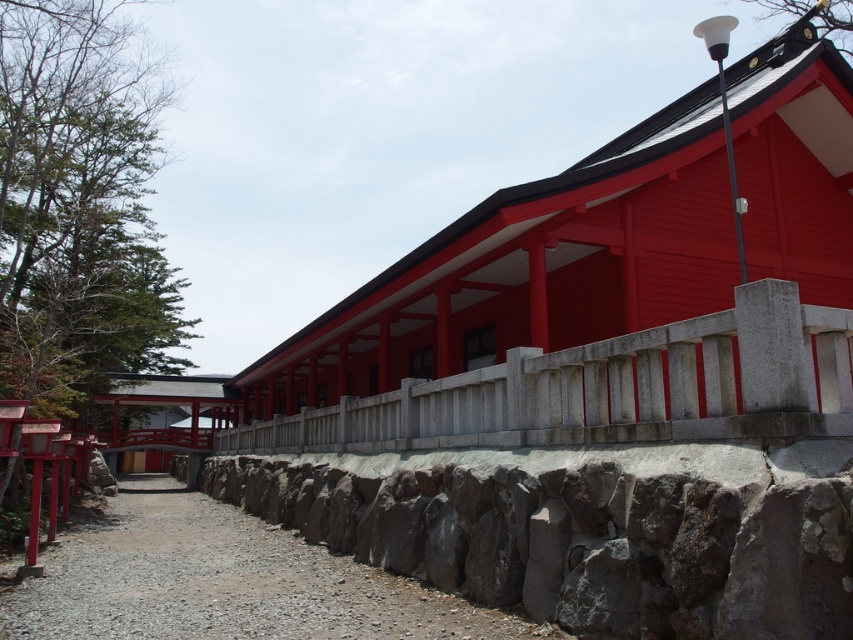
Question: Which object is closer to the camera taking this photo?

Choices:
 (A) gray gravel path at center
 (B) gray stone railing at center

Answer: (B)

Question: Can you confirm if gray rough stone wall at center is smaller than gray gravel path at center?

Choices:
 (A) no
 (B) yes

Answer: (B)

Question: Which object is the farthest from the gray gravel path at center?

Choices:
 (A) gray stone railing at center
 (B) gray rough stone wall at center

Answer: (A)

Question: Which object is closer to the camera taking this photo?

Choices:
 (A) gray stone railing at center
 (B) gray gravel path at center
 (C) gray rough stone wall at center

Answer: (C)

Question: In this image, where is gray stone railing at center located relative to gray gravel path at center?

Choices:
 (A) above
 (B) below

Answer: (A)

Question: Can you confirm if gray rough stone wall at center is positioned above gray gravel path at center?

Choices:
 (A) no
 (B) yes

Answer: (B)